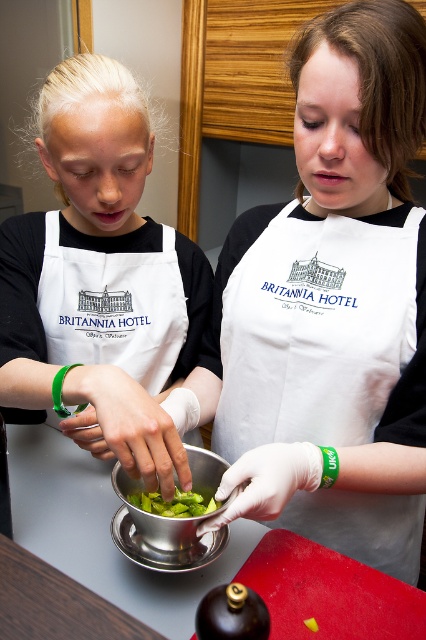
Question: Does matte white apron at left appear on the left side of white cotton apron at center?

Choices:
 (A) yes
 (B) no

Answer: (A)

Question: Among these points, which one is farthest from the camera?

Choices:
 (A) (121, 460)
 (B) (218, 547)

Answer: (B)

Question: Is matte white apron at left to the right of metallic silver bowl at center from the viewer's perspective?

Choices:
 (A) yes
 (B) no

Answer: (B)

Question: Is matte white apron at left positioned in front of metallic silver bowl at center?

Choices:
 (A) no
 (B) yes

Answer: (B)

Question: Which point appears farthest from the camera in this image?

Choices:
 (A) (147, 506)
 (B) (123, 502)
 (C) (342, 278)

Answer: (C)

Question: Which of these objects is positioned closest to the matte white apron at left?

Choices:
 (A) white cotton apron at center
 (B) metallic silver bowl at center
 (C) green leafy vegetable at center

Answer: (A)